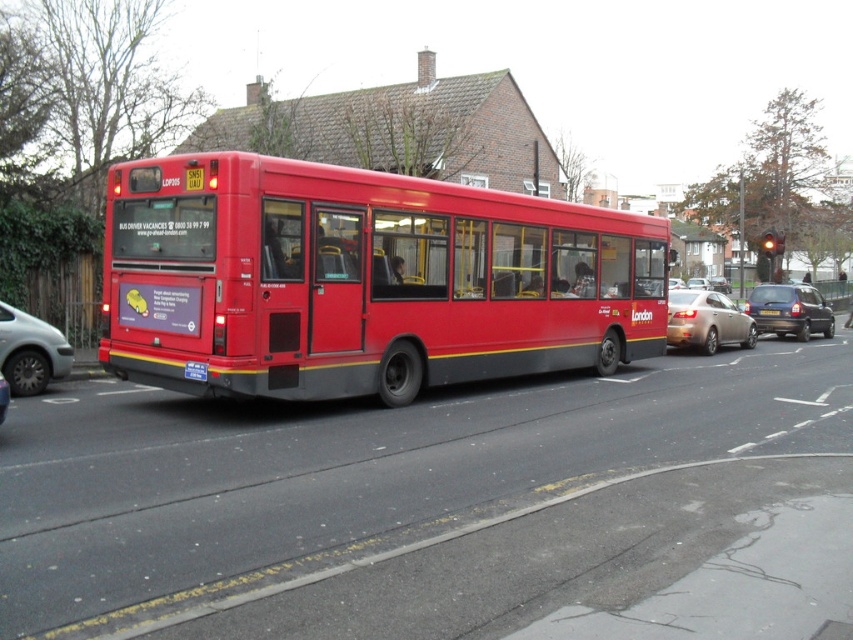
Can you confirm if silver metallic van at left is shorter than metallic blue hatchback at right?

Yes, silver metallic van at left is shorter than metallic blue hatchback at right.

Which is in front, point (6, 321) or point (811, 291)?

Point (6, 321) is more forward.

This screenshot has width=853, height=640. What do you see at coordinates (30, 352) in the screenshot?
I see `silver metallic van at left` at bounding box center [30, 352].

The height and width of the screenshot is (640, 853). Identify the location of silver metallic van at left. (30, 352).

Is the position of metallic silver sedan at center less distant than that of metallic silver car at center?

No, metallic silver sedan at center is behind metallic silver car at center.

The width and height of the screenshot is (853, 640). What do you see at coordinates (706, 321) in the screenshot?
I see `metallic silver sedan at center` at bounding box center [706, 321].

Is point (717, 339) positioned in front of point (3, 404)?

No, (717, 339) is further to viewer.

The image size is (853, 640). I want to click on metallic silver sedan at center, so click(x=706, y=321).

Is metallic blue hatchback at right taller than metallic silver car at center?

Indeed, metallic blue hatchback at right has a greater height compared to metallic silver car at center.

The height and width of the screenshot is (640, 853). What do you see at coordinates (790, 310) in the screenshot? I see `metallic blue hatchback at right` at bounding box center [790, 310].

Where is `metallic blue hatchback at right`? This screenshot has width=853, height=640. metallic blue hatchback at right is located at coordinates (790, 310).